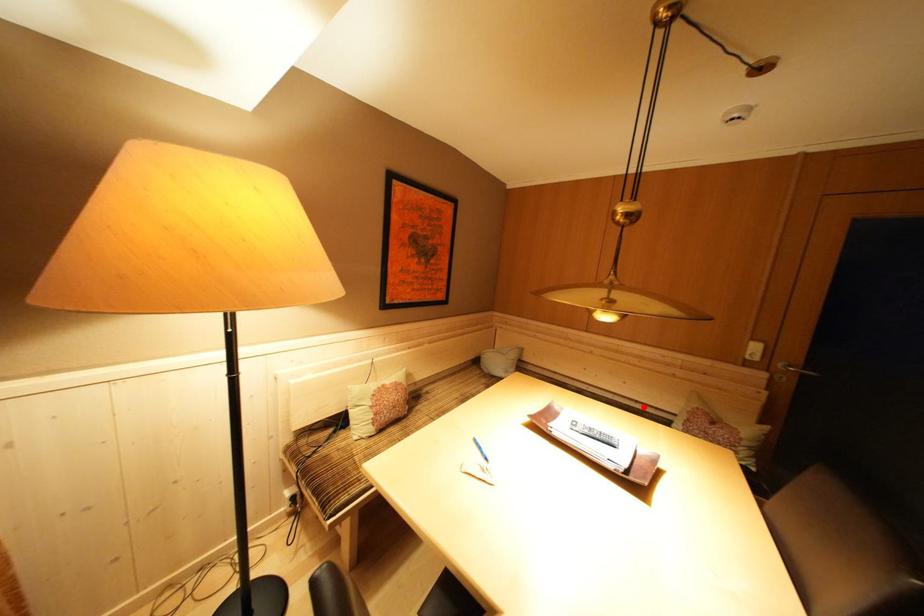
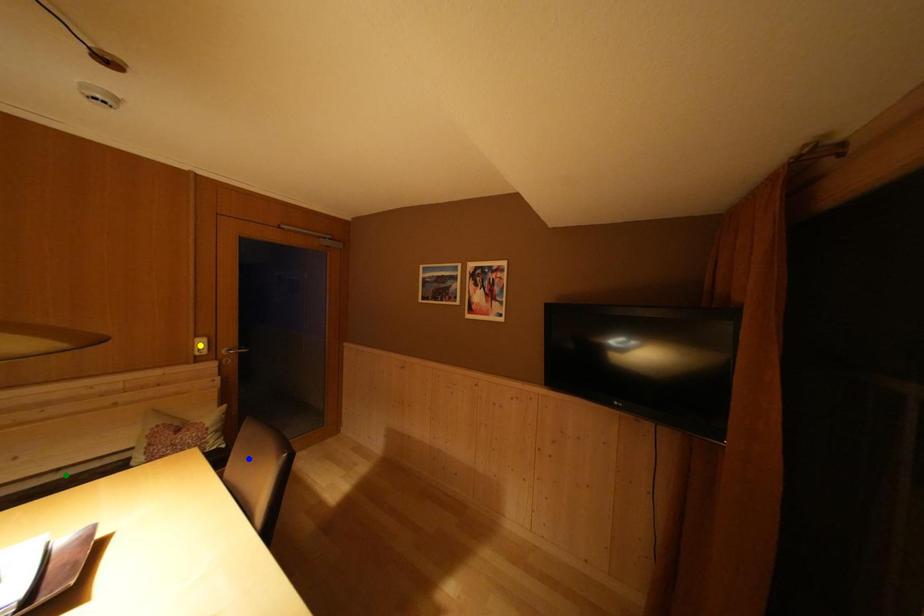
Question: I am providing you with two images of the same scene from different viewpoints. A red point is marked on the first image. You are given multiple points on the second image. In image 2, which mark is for the same physical point as the one in image 1?

Choices:
 (A) yellow point
 (B) blue point
 (C) green point

Answer: (C)